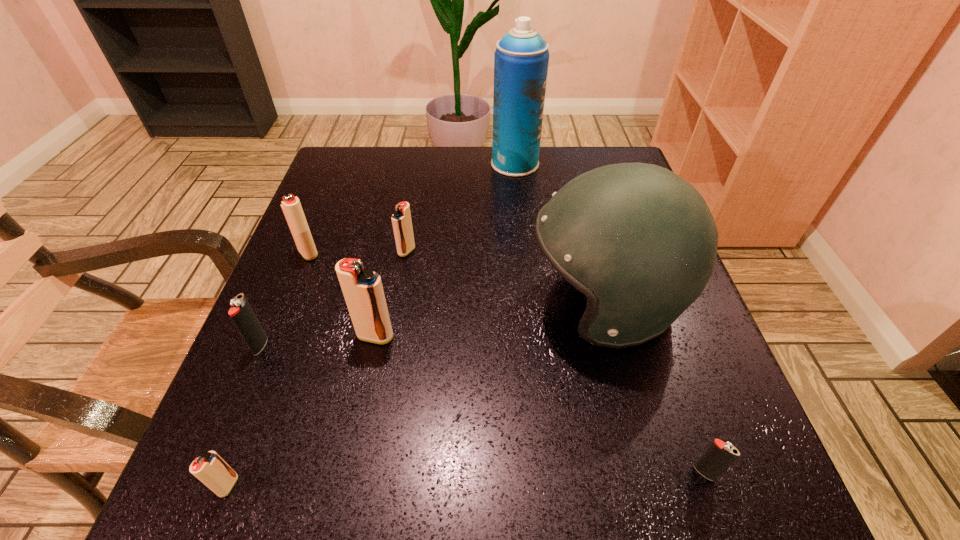
This screenshot has height=540, width=960. Identify the location of vacant space located on the front of the farther black igniter. (241, 392).

What are the coordinates of `free space located on the front of the third biggest red igniter` in the screenshot? It's located at (x=400, y=285).

Locate an element on the screen. The height and width of the screenshot is (540, 960). free space located on the back of the nearest red igniter is located at coordinates (271, 374).

Identify the location of vacant region located on the back of the nearer black igniter. This screenshot has width=960, height=540. (652, 321).

This screenshot has height=540, width=960. What are the coordinates of `object at the far edge` in the screenshot? It's located at (521, 59).

The image size is (960, 540). I want to click on football helmet situated at the right edge, so click(x=640, y=242).

You are a GUI agent. You are given a task and a screenshot of the screen. Output one action in this format:
    pyautogui.click(x=<x>, y=<y>)
    Task: Click on the igniter that is at the right edge
    Image resolution: width=960 pixels, height=540 pixels.
    Given the screenshot: What is the action you would take?
    pyautogui.click(x=719, y=455)

In order to click on object that is at the near left corner in this screenshot , I will do `click(210, 469)`.

At what (x,y) coordinates should I click in order to perform the action: click on object that is at the near right corner. Please return your answer as a coordinate pair (x, y). Looking at the image, I should click on (719, 455).

The image size is (960, 540). Find the location of `vacant region at the far edge of the desktop`. vacant region at the far edge of the desktop is located at coordinates (485, 199).